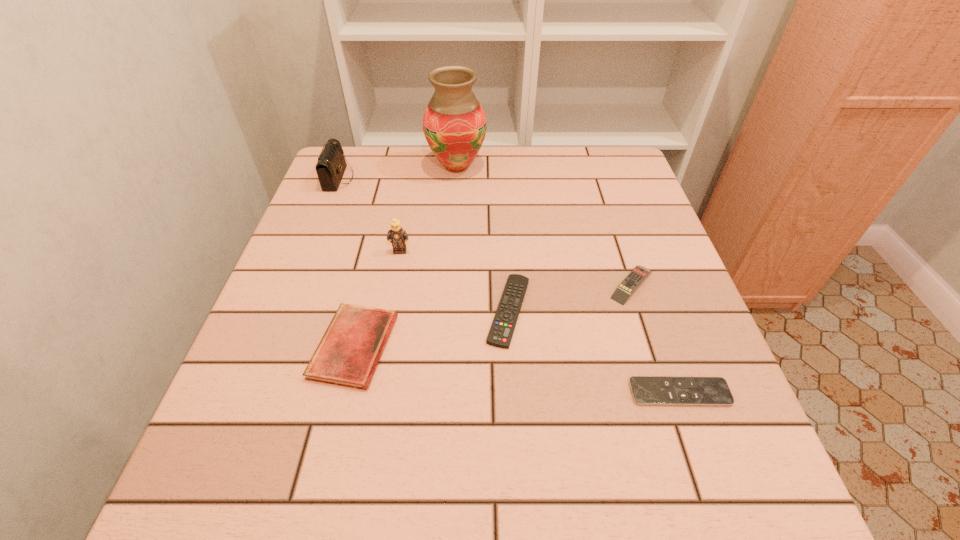
You are a GUI agent. You are given a task and a screenshot of the screen. Output one action in this format:
    pyautogui.click(x=<x>, y=<y>)
    Task: Click on the object located at the far left corner
    The image size is (960, 540).
    Given the screenshot: What is the action you would take?
    pyautogui.click(x=331, y=165)

You are a GUI agent. You are given a task and a screenshot of the screen. Output one action in this format:
    pyautogui.click(x=<x>, y=<y>)
    Task: Click on the vacant area at the far edge of the desktop
    Image resolution: width=960 pixels, height=540 pixels.
    Given the screenshot: What is the action you would take?
    pyautogui.click(x=490, y=186)

In the image, there is a desktop. Where is `vacant space at the near edge`? vacant space at the near edge is located at coordinates (429, 484).

The image size is (960, 540). Identify the location of vacant space at the left edge. (248, 359).

Where is `vacant space at the right edge of the desktop`? The width and height of the screenshot is (960, 540). vacant space at the right edge of the desktop is located at coordinates (674, 313).

At what (x,y) coordinates should I click in order to perform the action: click on vacant space at the far left corner of the desktop. Please return your answer as a coordinate pair (x, y). Looking at the image, I should click on (x=382, y=158).

Where is `vacant space at the far right corner of the desktop`? The height and width of the screenshot is (540, 960). vacant space at the far right corner of the desktop is located at coordinates (635, 180).

You are a GUI agent. You are given a task and a screenshot of the screen. Output one action in this format:
    pyautogui.click(x=<x>, y=<y>)
    Task: Click on the free space between the shortest object and the leftmost remote control
    The image size is (960, 540).
    Given the screenshot: What is the action you would take?
    pyautogui.click(x=594, y=352)

Image resolution: width=960 pixels, height=540 pixels. In order to click on vacant region between the diary and the tallest remote control in this screenshot , I will do `click(493, 315)`.

The width and height of the screenshot is (960, 540). Identify the location of vacant area between the fifth nearest object and the tallest remote control. (516, 268).